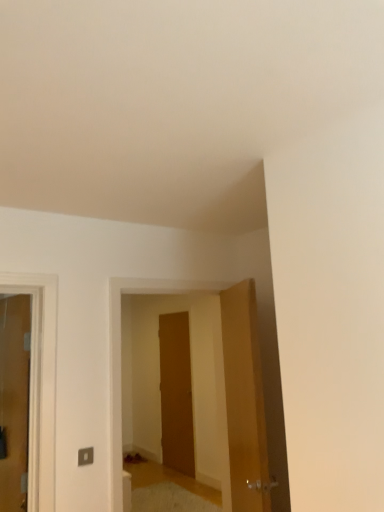
Where is `wooden door at center, the 1th door positioned from the back`? Image resolution: width=384 pixels, height=512 pixels. wooden door at center, the 1th door positioned from the back is located at coordinates (176, 393).

Measure the distance between point (x=24, y=354) and camera.

They are 8.14 feet apart.

The height and width of the screenshot is (512, 384). What do you see at coordinates (14, 400) in the screenshot?
I see `matte wooden door at left, which is the third door in right-to-left order` at bounding box center [14, 400].

This screenshot has height=512, width=384. I want to click on wooden door at right, arranged as the first door when viewed from the right, so click(245, 401).

Locate an element on the screen. The image size is (384, 512). the 2nd door to the left when counting from the wooden door at center is located at coordinates (14, 400).

From the image's perspective, would you say wooden door at center is positioned over matte wooden door at left, which is the third door in right-to-left order?

No, from the image's perspective, wooden door at center is not on top of matte wooden door at left, which is the third door in right-to-left order.

Which point is more forward, (118,454) or (14,390)?

The point (118,454) is closer.

Is matte wooden door at left, the second door positioned from the back, to the right of wooden door at center from the viewer's perspective?

In fact, matte wooden door at left, the second door positioned from the back, is to the left of wooden door at center.

Is matte wooden door at left, the second door positioned from the back, oriented away from wooden door at center?

That's right, matte wooden door at left, the second door positioned from the back, is facing away from wooden door at center.

Is matte wooden door at left, positioned as the second door in front-to-back order, completely or partially outside of wooden door at center?

That's correct, matte wooden door at left, positioned as the second door in front-to-back order, is outside of wooden door at center.

Looking at this image, from a real-world perspective, is matte wooden door at left, the second door positioned from the back, physically above wooden door at center, the 2th door when ordered from right to left?

Indeed, from a real-world perspective, matte wooden door at left, the second door positioned from the back, stands above wooden door at center, the 2th door when ordered from right to left.

Is the depth of matte wooden door at left, which is the third door in right-to-left order, greater than that of wooden door at center, positioned as the second door in left-to-right order?

No, matte wooden door at left, which is the third door in right-to-left order, is closer to the camera.

Looking at their sizes, would you say matte wooden door at left, which is the third door in right-to-left order, is wider or thinner than wooden door at center, the 1th door positioned from the back?

In the image, matte wooden door at left, which is the third door in right-to-left order, appears to be wider than wooden door at center, the 1th door positioned from the back.

Does matte wooden door at left, positioned as the 1th door in left-to-right order, appear on the left side of wooden door at center, the 1th door positioned from the back?

Yes.

From the picture: Is wooden door at center taller or shorter than wooden door at right, which is counted as the 3th door, starting from the back?

In the image, wooden door at center appears to be taller than wooden door at right, which is counted as the 3th door, starting from the back.

Is the surface of wooden door at center in direct contact with wooden door at right, which is counted as the 3th door, starting from the back?

No, wooden door at center is not making contact with wooden door at right, which is counted as the 3th door, starting from the back.

Considering the sizes of wooden door at center and wooden door at right, arranged as the first door when viewed from the right, in the image, is wooden door at center bigger or smaller than wooden door at right, arranged as the first door when viewed from the right,?

Considering their sizes, wooden door at center takes up more space than wooden door at right, arranged as the first door when viewed from the right.

From the image's perspective, does wooden door at center appear higher than wooden door at right, the first door in the front-to-back sequence?

Actually, wooden door at center appears below wooden door at right, the first door in the front-to-back sequence, in the image.

Is wooden door at center, which is the 3th door from front to back, positioned far away from wooden door at right, the first door in the front-to-back sequence?

wooden door at center, which is the 3th door from front to back, is positioned a significant distance from wooden door at right, the first door in the front-to-back sequence.

Between wooden door at center, the 2th door when ordered from right to left, and wooden door at right, which is counted as the 3th door, starting from the back, which one is positioned in front?

wooden door at right, which is counted as the 3th door, starting from the back, is closer to the camera.

In the image, is wooden door at center, the 1th door positioned from the back, on the left side or the right side of wooden door at right, positioned as the 3th door in left-to-right order?

From the image, it's evident that wooden door at center, the 1th door positioned from the back, is to the left of wooden door at right, positioned as the 3th door in left-to-right order.

Considering the sizes of objects wooden door at right, which is counted as the 3th door, starting from the back, and wooden door at center, the 2th door when ordered from right to left, in the image provided, who is wider, wooden door at right, which is counted as the 3th door, starting from the back, or wooden door at center, the 2th door when ordered from right to left,?

wooden door at right, which is counted as the 3th door, starting from the back.

Consider the image. Could you measure the distance between wooden door at right, the first door in the front-to-back sequence, and wooden door at center, the 2th door when ordered from right to left?

wooden door at right, the first door in the front-to-back sequence, is 11.31 feet away from wooden door at center, the 2th door when ordered from right to left.

Which is more to the right, wooden door at right, which is counted as the 3th door, starting from the back, or wooden door at center, positioned as the second door in left-to-right order?

Positioned to the right is wooden door at right, which is counted as the 3th door, starting from the back.

Find the location of `door that is the 2nd one when counting downward from the wooden door at right, the first door in the front-to-back sequence (from the image's perspective)`. door that is the 2nd one when counting downward from the wooden door at right, the first door in the front-to-back sequence (from the image's perspective) is located at coordinates (176, 393).

From the image's perspective, between wooden door at center, the 2th door when ordered from right to left, and wooden door at center, who is located below?

wooden door at center, the 2th door when ordered from right to left.

Is wooden door at center, the 1th door positioned from the back, looking in the opposite direction of wooden door at center?

wooden door at center, the 1th door positioned from the back, is not turned away from wooden door at center.

Does wooden door at center, positioned as the second door in left-to-right order, have a lesser height compared to wooden door at center?

No, wooden door at center, positioned as the second door in left-to-right order, is not shorter than wooden door at center.

Is wooden door at center, positioned as the second door in left-to-right order, not within wooden door at center?

Yes, wooden door at center, positioned as the second door in left-to-right order, is not within wooden door at center.

In order to click on door that is the 1st object located above the wooden door at center (from the image's perspective) in this screenshot , I will do `click(14, 400)`.

Where is `door located above the wooden door at center (from a real-world perspective)`? The width and height of the screenshot is (384, 512). door located above the wooden door at center (from a real-world perspective) is located at coordinates (14, 400).

Considering their positions, is wooden door at right, positioned as the 3th door in left-to-right order, positioned closer to matte wooden door at left, which is the third door in right-to-left order, than wooden door at center, the 1th door positioned from the back?

wooden door at right, positioned as the 3th door in left-to-right order.

Estimate the real-world distances between objects in this image. Which object is further from wooden door at center, wooden door at right, arranged as the first door when viewed from the right, or wooden door at center, the 2th door when ordered from right to left?

The object further to wooden door at center is wooden door at center, the 2th door when ordered from right to left.

Based on their spatial positions, is wooden door at center or wooden door at right, arranged as the first door when viewed from the right, further from wooden door at center, the 1th door positioned from the back?

wooden door at right, arranged as the first door when viewed from the right, is further to wooden door at center, the 1th door positioned from the back.

From the image, which object appears to be farther from wooden door at right, arranged as the first door when viewed from the right, matte wooden door at left, which is the third door in right-to-left order, or wooden door at center, the 2th door when ordered from right to left?

wooden door at center, the 2th door when ordered from right to left, is positioned further to the anchor wooden door at right, arranged as the first door when viewed from the right.

From the image, which object appears to be nearer to wooden door at right, the first door in the front-to-back sequence, wooden door at center, the 1th door positioned from the back, or matte wooden door at left, positioned as the second door in front-to-back order?

The object closer to wooden door at right, the first door in the front-to-back sequence, is matte wooden door at left, positioned as the second door in front-to-back order.

When comparing their distances from wooden door at center, does matte wooden door at left, positioned as the 1th door in left-to-right order, or wooden door at center, the 1th door positioned from the back, seem closer?

matte wooden door at left, positioned as the 1th door in left-to-right order, is closer to wooden door at center.

Based on the photo, estimate the real-world distances between objects in this image. Which object is closer to wooden door at center, matte wooden door at left, positioned as the 1th door in left-to-right order, or wooden door at right, positioned as the 3th door in left-to-right order?

Among the two, matte wooden door at left, positioned as the 1th door in left-to-right order, is located nearer to wooden door at center.

Looking at the image, which one is located further to wooden door at center, the 1th door positioned from the back, matte wooden door at left, the second door positioned from the back, or wooden door at center?

Among the two, matte wooden door at left, the second door positioned from the back, is located further to wooden door at center, the 1th door positioned from the back.

The image size is (384, 512). I want to click on door located between wooden door at right, which is counted as the 3th door, starting from the back, and wooden door at center, positioned as the second door in left-to-right order, in the depth direction, so click(14, 400).

At what (x,y) coordinates should I click in order to perform the action: click on elevator situated between matte wooden door at left, positioned as the 1th door in left-to-right order, and wooden door at right, the first door in the front-to-back sequence, from left to right. Please return your answer as a coordinate pair (x, y). Looking at the image, I should click on (120, 360).

Locate an element on the screen. The image size is (384, 512). elevator between wooden door at right, arranged as the first door when viewed from the right, and wooden door at center, the 2th door when ordered from right to left, from front to back is located at coordinates (120, 360).

Locate an element on the screen. elevator between matte wooden door at left, which is the third door in right-to-left order, and wooden door at center, the 2th door when ordered from right to left, in the front-back direction is located at coordinates (120, 360).